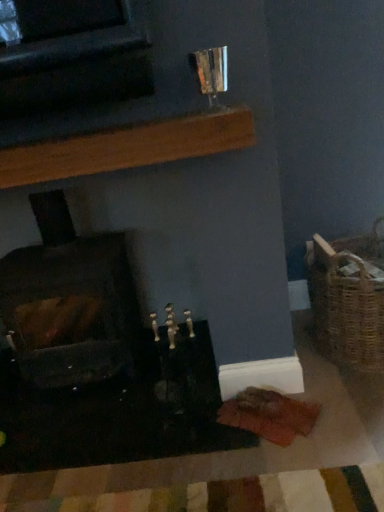
Question: From a real-world perspective, is woven brown basket at right physically below dark brown wood at left?

Choices:
 (A) yes
 (B) no

Answer: (A)

Question: Can you see woven brown basket at right touching dark brown wood at left?

Choices:
 (A) no
 (B) yes

Answer: (A)

Question: From a real-world perspective, is woven brown basket at right over dark brown wood at left?

Choices:
 (A) yes
 (B) no

Answer: (B)

Question: Does woven brown basket at right have a greater width compared to dark brown wood at left?

Choices:
 (A) no
 (B) yes

Answer: (A)

Question: Considering the relative positions of woven brown basket at right and dark brown wood at left in the image provided, is woven brown basket at right behind dark brown wood at left?

Choices:
 (A) yes
 (B) no

Answer: (B)

Question: Considering the relative sizes of woven brown basket at right and dark brown wood at left in the image provided, is woven brown basket at right thinner than dark brown wood at left?

Choices:
 (A) no
 (B) yes

Answer: (B)

Question: Is there a large distance between wooden plank at upper center and dark brown wood at left?

Choices:
 (A) yes
 (B) no

Answer: (B)

Question: Is wooden plank at upper center positioned beyond the bounds of dark brown wood at left?

Choices:
 (A) yes
 (B) no

Answer: (A)

Question: Can you confirm if wooden plank at upper center is taller than dark brown wood at left?

Choices:
 (A) no
 (B) yes

Answer: (A)

Question: Is wooden plank at upper center facing towards dark brown wood at left?

Choices:
 (A) yes
 (B) no

Answer: (B)

Question: Can you confirm if wooden plank at upper center is wider than dark brown wood at left?

Choices:
 (A) no
 (B) yes

Answer: (A)

Question: Is wooden plank at upper center placed right next to dark brown wood at left?

Choices:
 (A) no
 (B) yes

Answer: (A)

Question: Considering the relative sizes of woven brown basket at right and wooden plank at upper center in the image provided, is woven brown basket at right thinner than wooden plank at upper center?

Choices:
 (A) yes
 (B) no

Answer: (B)